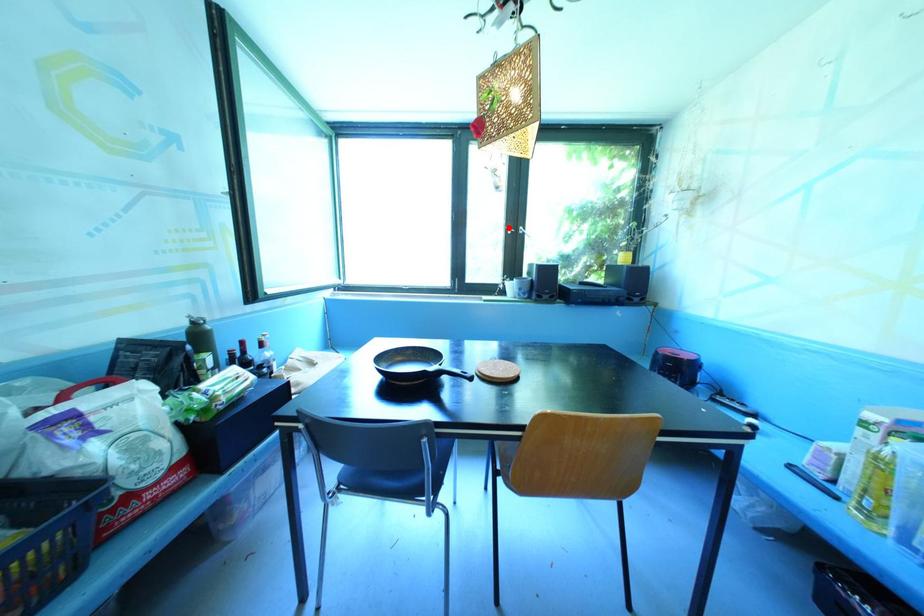
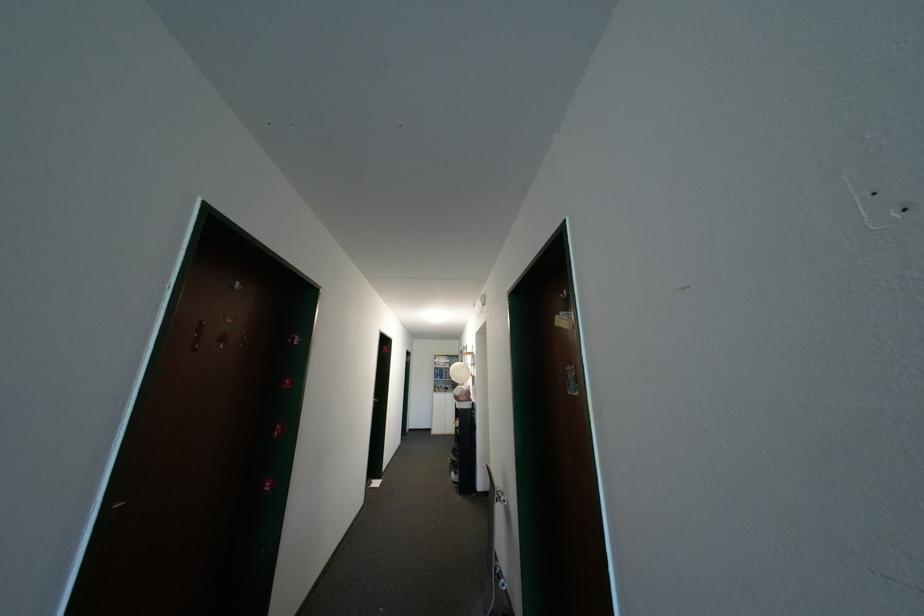
Question: I am providing you with two images of the same scene from different viewpoints. A red point is marked on the first image. Is the red point's position out of view in image 2?

Choices:
 (A) Yes
 (B) No

Answer: (A)